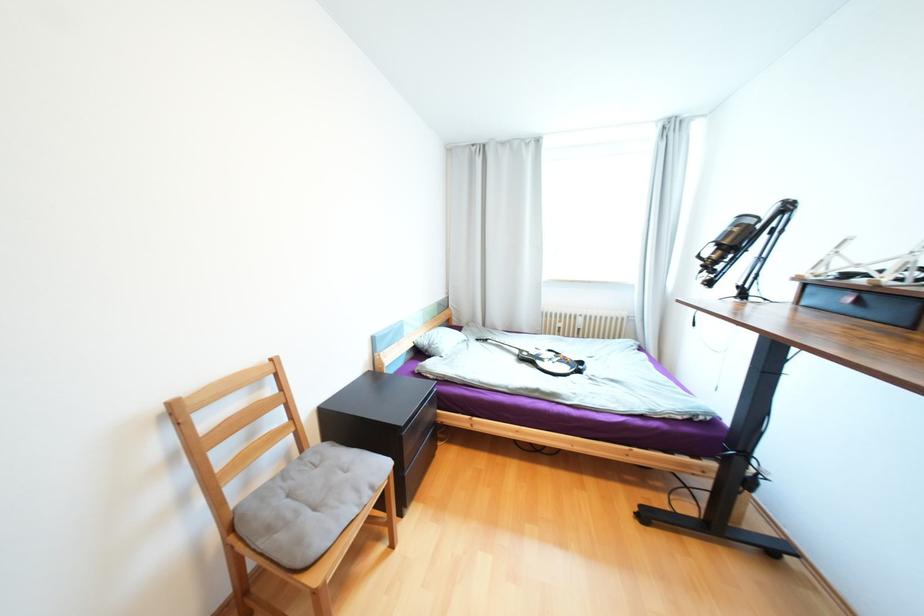
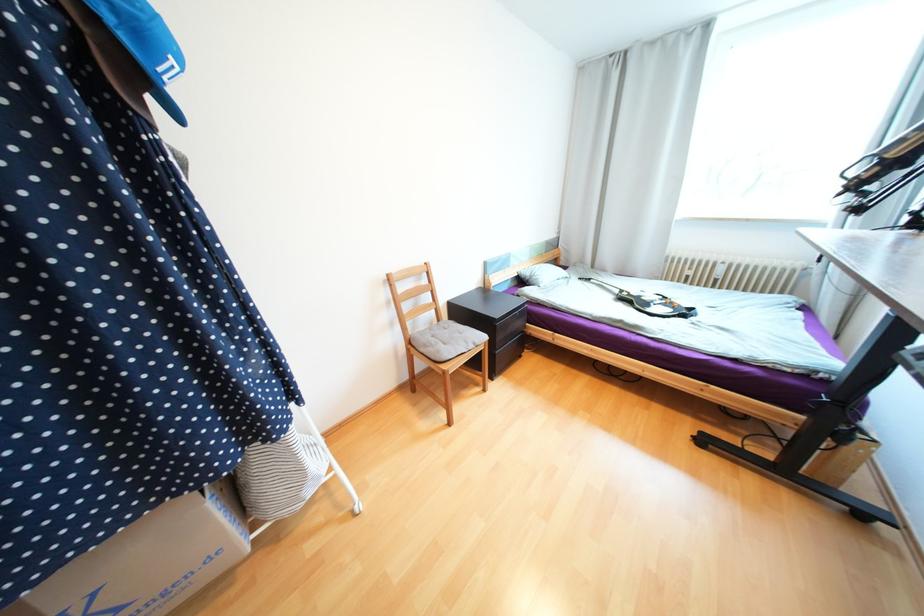
The point at (419, 339) is marked in the first image. Where is the corresponding point in the second image?

(524, 270)